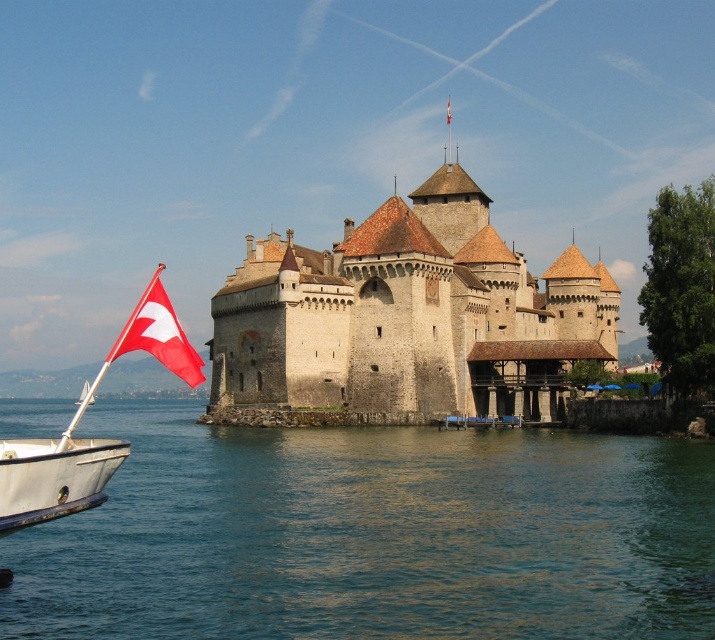
Which is more to the left, red fabric flag at left or red fabric flag at center?

red fabric flag at left is more to the left.

Does red fabric flag at left lie in front of red fabric flag at center?

Yes, it is in front of red fabric flag at center.

You are a GUI agent. You are given a task and a screenshot of the screen. Output one action in this format:
    pyautogui.click(x=<x>, y=<y>)
    Task: Click on the red fabric flag at left
    The height and width of the screenshot is (640, 715).
    Given the screenshot: What is the action you would take?
    pyautogui.click(x=157, y=333)

Is clear blue water at lower left below red fabric flag at left?

Yes.

Which is more to the left, clear blue water at lower left or red fabric flag at left?

red fabric flag at left

Who is more distant from viewer, [49,525] or [152,353]?

The point [49,525] is behind.

Find the location of a particular element. clear blue water at lower left is located at coordinates (373, 536).

What do you see at coordinates (405, 321) in the screenshot?
I see `stone medieval castle at center` at bounding box center [405, 321].

Does stone medieval castle at center come in front of red fabric flag at center?

That is True.

Is point (511, 404) positioned behind point (448, 118)?

No.

Where is `stone medieval castle at center`? The height and width of the screenshot is (640, 715). stone medieval castle at center is located at coordinates (405, 321).